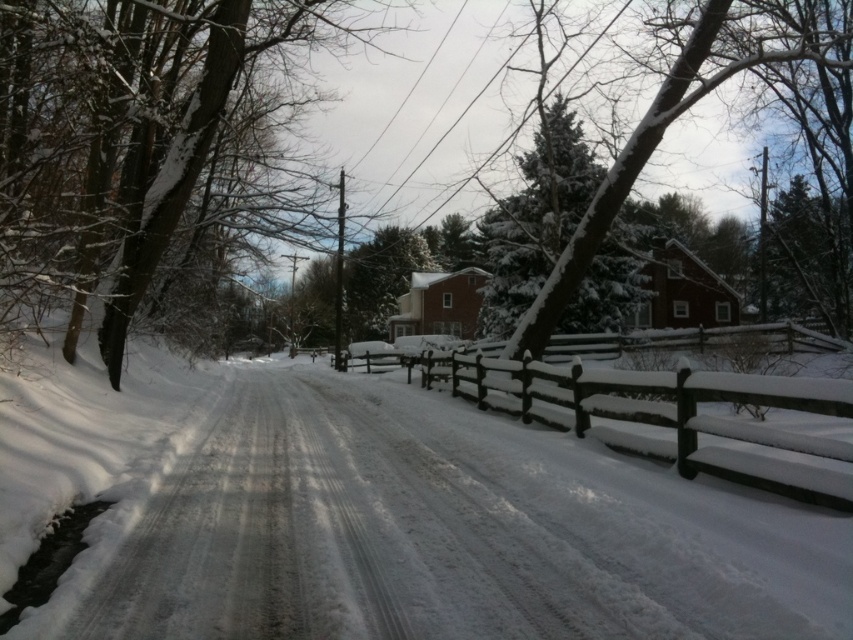
Is white powdery snow at center shorter than snow-covered wooden fence at center?

In fact, white powdery snow at center may be taller than snow-covered wooden fence at center.

Where is `white powdery snow at center`? white powdery snow at center is located at coordinates (392, 520).

You are a GUI agent. You are given a task and a screenshot of the screen. Output one action in this format:
    pyautogui.click(x=<x>, y=<y>)
    Task: Click on the white powdery snow at center
    
    Given the screenshot: What is the action you would take?
    pyautogui.click(x=392, y=520)

The height and width of the screenshot is (640, 853). Find the location of `white powdery snow at center`. white powdery snow at center is located at coordinates (392, 520).

Can you confirm if snow-covered tree at left is positioned above snow-covered wooden fence at center?

Correct, snow-covered tree at left is located above snow-covered wooden fence at center.

In the scene shown: Which of these two, snow-covered tree at left or snow-covered wooden fence at center, stands shorter?

snow-covered wooden fence at center is shorter.

Measure the distance between snow-covered tree at left and camera.

The distance of snow-covered tree at left from camera is 6.34 meters.

Find the location of a particular element. The height and width of the screenshot is (640, 853). snow-covered tree at left is located at coordinates (141, 141).

Looking at this image, can you confirm if snow-covered wooden fence at center is positioned below snow-covered evergreen at center?

Correct, snow-covered wooden fence at center is located below snow-covered evergreen at center.

This screenshot has height=640, width=853. Describe the element at coordinates (663, 413) in the screenshot. I see `snow-covered wooden fence at center` at that location.

The image size is (853, 640). What are the coordinates of `snow-covered wooden fence at center` in the screenshot? It's located at click(663, 413).